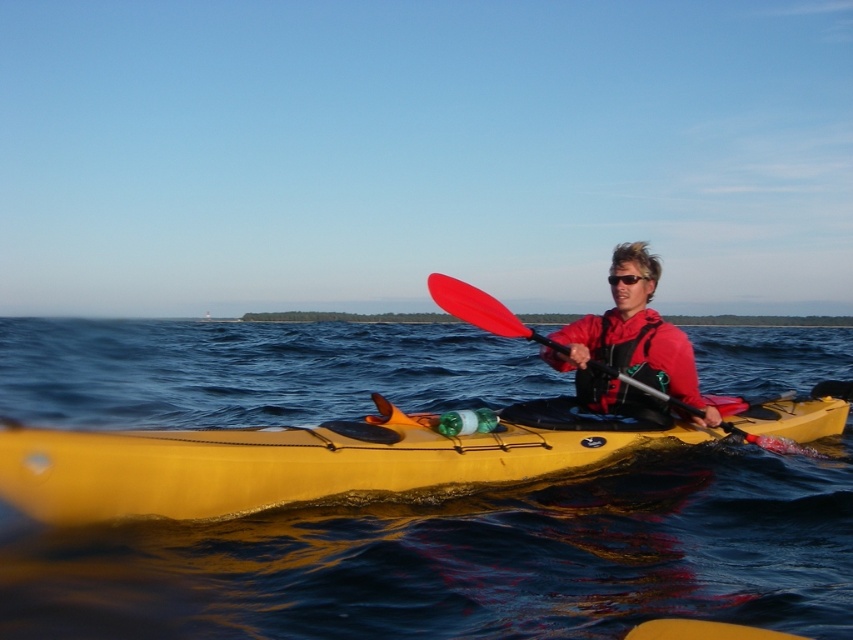
Question: Can you confirm if blue water at center is smaller than red matte kayak at center?

Choices:
 (A) no
 (B) yes

Answer: (A)

Question: Can you confirm if yellow matte kayak at center is positioned below red matte kayak at center?

Choices:
 (A) no
 (B) yes

Answer: (B)

Question: Which point appears farthest from the camera in this image?

Choices:
 (A) (422, 442)
 (B) (612, 285)
 (C) (549, 531)
 (D) (648, 387)

Answer: (B)

Question: Estimate the real-world distances between objects in this image. Which object is closer to the black plastic sunglasses at center?

Choices:
 (A) red fleece life jacket at center
 (B) blue water at center

Answer: (A)

Question: Is red fleece life jacket at center below black plastic sunglasses at center?

Choices:
 (A) no
 (B) yes

Answer: (B)

Question: Which point is farther to the camera?

Choices:
 (A) red fleece life jacket at center
 (B) black plastic sunglasses at center
 (C) yellow matte kayak at center
 (D) red plastic paddle at center

Answer: (B)